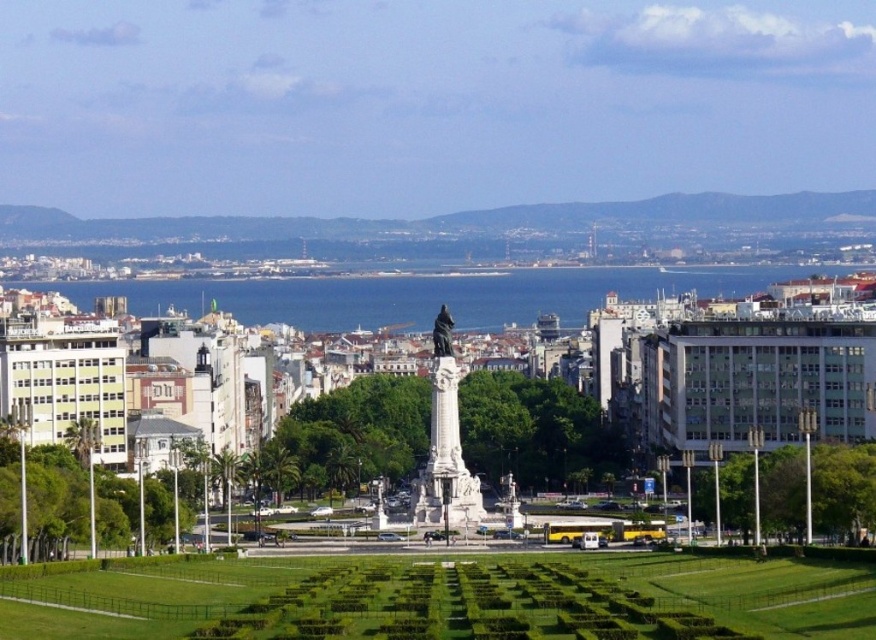
Who is taller, blue water at center or bronze statue at center?

With more height is blue water at center.

Does blue water at center have a larger size compared to bronze statue at center?

Yes, blue water at center is bigger than bronze statue at center.

Between point (354, 285) and point (447, 316), which one is positioned in front?

Point (447, 316)

The width and height of the screenshot is (876, 640). Identify the location of blue water at center. (421, 294).

Does blue water at center have a lesser width compared to white marble statue at center?

Incorrect, blue water at center's width is not less than white marble statue at center's.

Which is in front, point (285, 284) or point (433, 355)?

Point (433, 355)

This screenshot has width=876, height=640. I want to click on blue water at center, so click(x=421, y=294).

Which is more to the left, white marble statue at center or bronze statue at center?

bronze statue at center is more to the left.

Is white marble statue at center to the right of bronze statue at center from the viewer's perspective?

Correct, you'll find white marble statue at center to the right of bronze statue at center.

This screenshot has width=876, height=640. I want to click on white marble statue at center, so click(444, 444).